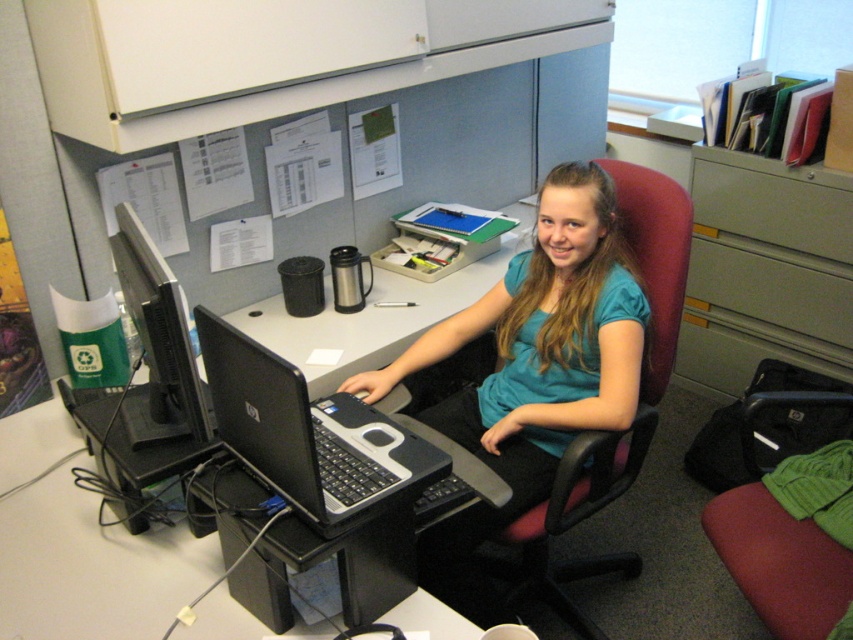
Question: Among these points, which one is nearest to the camera?

Choices:
 (A) [x=769, y=394]
 (B) [x=743, y=214]
 (C) [x=178, y=388]
 (D) [x=425, y=292]

Answer: (C)

Question: Can you confirm if black matte laptop at center is bigger than green knitted sweater at lower right?

Choices:
 (A) yes
 (B) no

Answer: (B)

Question: Does black plastic computer desk at center appear over green matte drawer at right?

Choices:
 (A) yes
 (B) no

Answer: (B)

Question: Considering the real-world distances, which object is farthest from the matte gray drawer at center right?

Choices:
 (A) green knitted sweater at lower right
 (B) black matte laptop at center
 (C) black glossy monitor at left

Answer: (C)

Question: Observing the image, what is the correct spatial positioning of black matte laptop at center in reference to black plastic computer desk at center?

Choices:
 (A) above
 (B) below

Answer: (B)

Question: Estimate the real-world distances between objects in this image. Which object is farther from the black glossy monitor at left?

Choices:
 (A) black plastic computer desk at center
 (B) green knitted sweater at lower right
 (C) teal fabric shirt at center

Answer: (B)